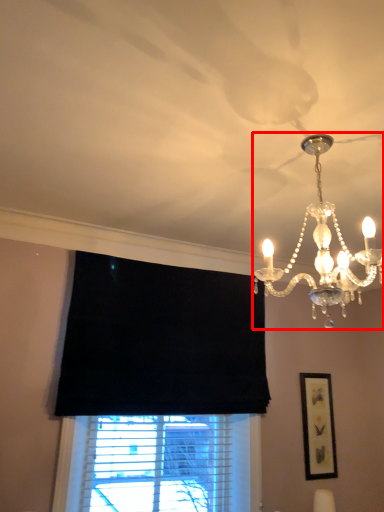
Question: From the image's perspective, what is the correct spatial positioning of lamp (annotated by the red box) in reference to picture frame?

Choices:
 (A) below
 (B) above

Answer: (B)